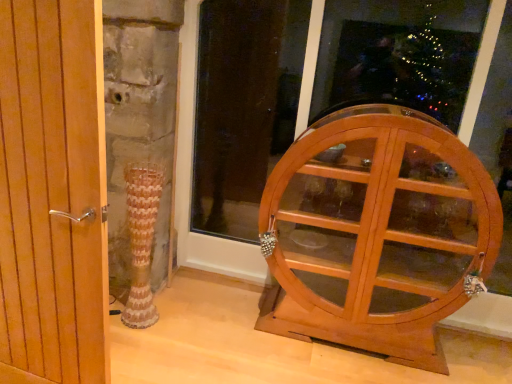
Find the location of `wooden cabinet at right`. wooden cabinet at right is located at coordinates (191, 177).

What is the approximate width of wooden door handle at left?

wooden door handle at left is 2.71 inches in width.

Locate an element on the screen. The width and height of the screenshot is (512, 384). wooden cabinet at right is located at coordinates (191, 177).

Does wooden cabinet at right have a lesser height compared to wooden door handle at left?

No.

How much distance is there between wooden cabinet at right and wooden door handle at left?

1.36 meters.

From the image's perspective, is wooden cabinet at right on top of wooden door handle at left?

Yes, from the image's perspective, wooden cabinet at right is above wooden door handle at left.

From a real-world perspective, is wooden cabinet at right positioned above or below light brown wooden cabinet at right?

wooden cabinet at right is situated higher than light brown wooden cabinet at right in the real world.

From the image's perspective, relative to light brown wooden cabinet at right, is wooden cabinet at right above or below?

Clearly, from the image's perspective, wooden cabinet at right is above light brown wooden cabinet at right.

Considering the relative sizes of wooden cabinet at right and light brown wooden cabinet at right in the image provided, is wooden cabinet at right wider than light brown wooden cabinet at right?

Yes.

Is light brown wooden cabinet at right not within wooden door handle at left?

Yes.

From the image's perspective, which one is positioned lower, light brown wooden cabinet at right or wooden door handle at left?

light brown wooden cabinet at right.

Is point (399, 122) less distant than point (44, 316)?

No, (399, 122) is behind (44, 316).

Which point is more forward, (394, 114) or (184, 124)?

Point (394, 114)

How many degrees apart are the facing directions of light brown wooden cabinet at right and wooden cabinet at right?

They differ by 0.0237 degrees in their facing directions.

Can you confirm if light brown wooden cabinet at right is wider than wooden cabinet at right?

No.

How much distance is there between light brown wooden cabinet at right and wooden cabinet at right?

They are 39.20 inches apart.

Is wooden door handle at left oriented away from light brown wooden cabinet at right?

No, light brown wooden cabinet at right is not at the back of wooden door handle at left.

From a real-world perspective, which is physically above, wooden door handle at left or light brown wooden cabinet at right?

From a 3D spatial view, wooden door handle at left is above.

From the picture: What's the angular difference between wooden door handle at left and light brown wooden cabinet at right's facing directions?

They differ by 3.13 degrees in their facing directions.

From a real-world perspective, which is physically below, wooden door handle at left or wooden cabinet at right?

wooden door handle at left.

Is wooden door handle at left oriented towards wooden cabinet at right?

No, wooden door handle at left does not turn towards wooden cabinet at right.

Identify the location of window frame on the right of wooden door handle at left. (191, 177).

From the image's perspective, would you say wooden door handle at left is positioned over wooden cabinet at right?

No, from the image's perspective, wooden door handle at left is not above wooden cabinet at right.

The height and width of the screenshot is (384, 512). In order to click on door in front of the wooden cabinet at right in this screenshot , I will do `click(51, 194)`.

Locate an element on the screen. furniture that appears below the wooden cabinet at right (from the image's perspective) is located at coordinates (376, 236).

Looking at the image, which one is located further to light brown wooden cabinet at right, wooden door handle at left or wooden cabinet at right?

wooden door handle at left.

Looking at the image, which one is located closer to light brown wooden cabinet at right, wooden cabinet at right or wooden door handle at left?

wooden cabinet at right is positioned closer to the anchor light brown wooden cabinet at right.

From the image, which object appears to be nearer to wooden door handle at left, wooden cabinet at right or light brown wooden cabinet at right?

light brown wooden cabinet at right is positioned closer to the anchor wooden door handle at left.

Considering their positions, is wooden door handle at left positioned further to wooden cabinet at right than light brown wooden cabinet at right?

wooden door handle at left is positioned further to the anchor wooden cabinet at right.

When comparing their distances from wooden cabinet at right, does light brown wooden cabinet at right or wooden door handle at left seem further?

Based on the image, wooden door handle at left appears to be further to wooden cabinet at right.

Which object lies nearer to the anchor point wooden door handle at left, light brown wooden cabinet at right or wooden cabinet at right?

The object closer to wooden door handle at left is light brown wooden cabinet at right.

At what (x,y) coordinates should I click in order to perform the action: click on furniture located between wooden door handle at left and wooden cabinet at right in the left-right direction. Please return your answer as a coordinate pair (x, y). Looking at the image, I should click on (376, 236).